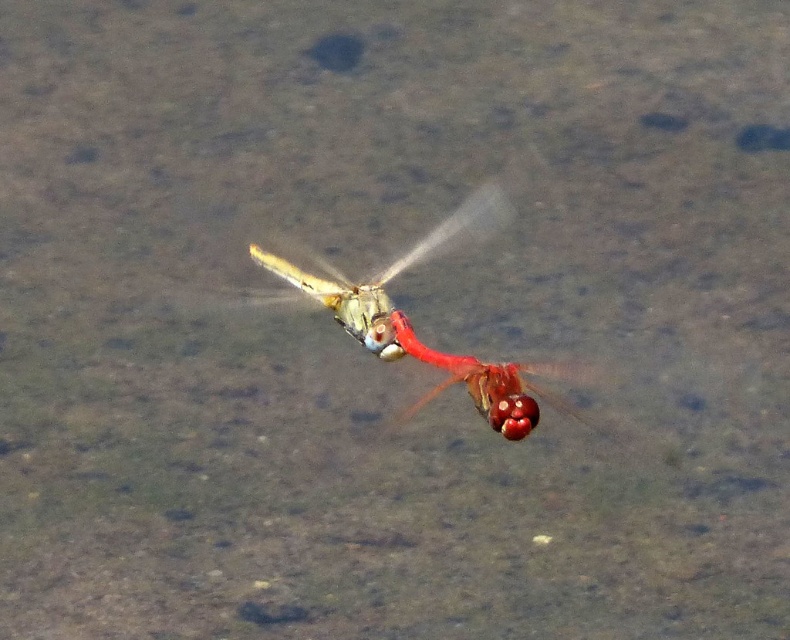
Which of these two, translucent yellow-green dragonfly at center or glossy red dragonfly at center, stands taller?

translucent yellow-green dragonfly at center

Is translucent yellow-green dragonfly at center above glossy red dragonfly at center?

Yes.

Between point (491, 211) and point (478, 385), which one is positioned behind?

Positioned behind is point (491, 211).

The image size is (790, 640). I want to click on translucent yellow-green dragonfly at center, so pos(388,273).

Which is above, translucent glass dragonfly at center or glossy red dragonfly at center?

Positioned higher is translucent glass dragonfly at center.

Can you confirm if translucent glass dragonfly at center is thinner than glossy red dragonfly at center?

Incorrect, translucent glass dragonfly at center's width is not less than glossy red dragonfly at center's.

What are the coordinates of `translucent glass dragonfly at center` in the screenshot? It's located at (423, 342).

Can you confirm if translucent glass dragonfly at center is positioned above translucent yellow-green dragonfly at center?

Incorrect, translucent glass dragonfly at center is not positioned above translucent yellow-green dragonfly at center.

You are a GUI agent. You are given a task and a screenshot of the screen. Output one action in this format:
    pyautogui.click(x=<x>, y=<y>)
    Task: Click on the translucent glass dragonfly at center
    This screenshot has height=640, width=790.
    Given the screenshot: What is the action you would take?
    pyautogui.click(x=423, y=342)